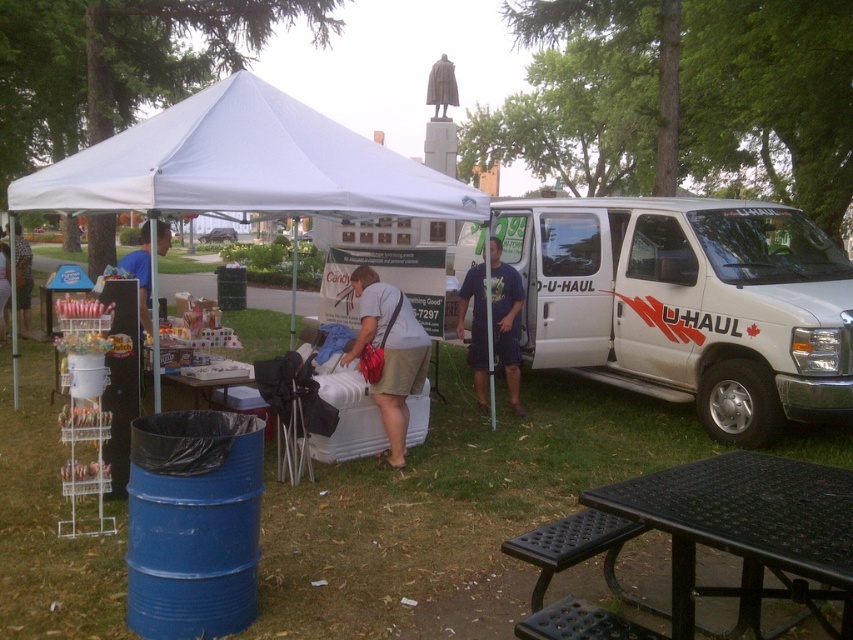
You are standing in the park and want to set up a small table for a snack bar. The table requires 5 meters of space from where you are standing to place it safely. Can you place the table near the white fabric canopy at center?

The white fabric canopy at center is 4.86 meters away from you, so yes, you can place the table near it since the distance is within the required 5 meters.

You are at the community event and want to place a new item display table between the white fabric canopy at center and the matte white cooler at center. Which object should you place the table closer to if you want it to be on the left side of the cooler?

You should place the table closer to the white fabric canopy at center because it is already positioned to the left of the matte white cooler at center, so placing the table near the canopy would keep it on the left side of the cooler.